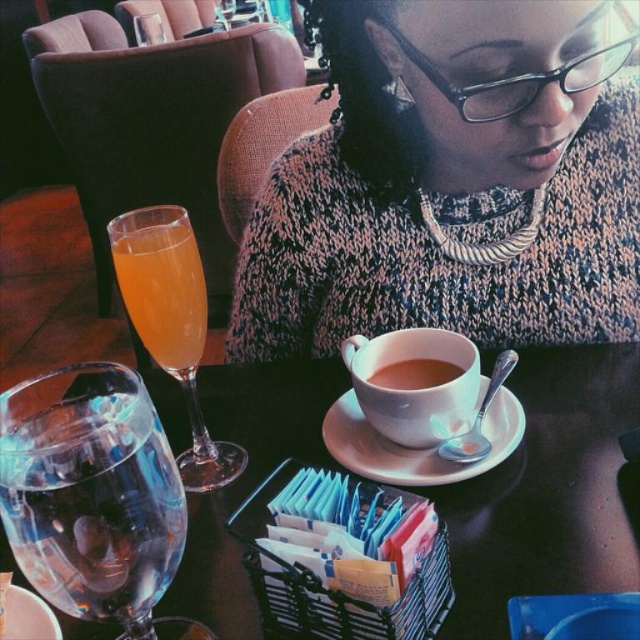
Question: Which object is the closest to the matte ceramic cup at center?

Choices:
 (A) translucent glass wine glass at left
 (B) white ceramic saucer at center

Answer: (B)

Question: Which object is positioned closest to the orange translucent glass at left?

Choices:
 (A) white ceramic saucer at center
 (B) translucent glass wine glass at left

Answer: (B)

Question: Considering the real-world distances, which object is closest to the translucent glass table at center?

Choices:
 (A) transparent glass at lower left
 (B) white ceramic saucer at center
 (C) brown matte cup at center
 (D) orange translucent glass at left

Answer: (B)

Question: Does translucent glass table at center have a lesser width compared to translucent glass wine glass at left?

Choices:
 (A) yes
 (B) no

Answer: (B)

Question: Is translucent glass table at center in front of brown matte cup at center?

Choices:
 (A) no
 (B) yes

Answer: (B)

Question: Can you confirm if translucent glass table at center is smaller than transparent glass at lower left?

Choices:
 (A) yes
 (B) no

Answer: (B)